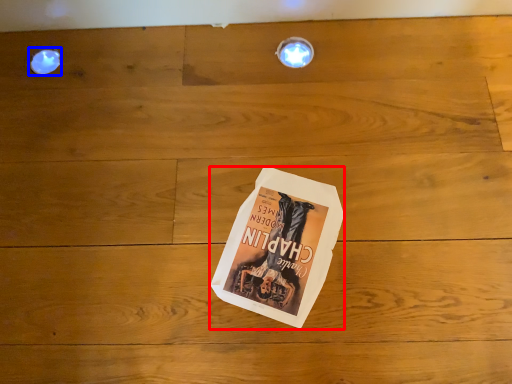
Question: Which object is further to the camera taking this photo, paperback book (highlighted by a red box) or droplight (highlighted by a blue box)?

Choices:
 (A) paperback book
 (B) droplight

Answer: (B)